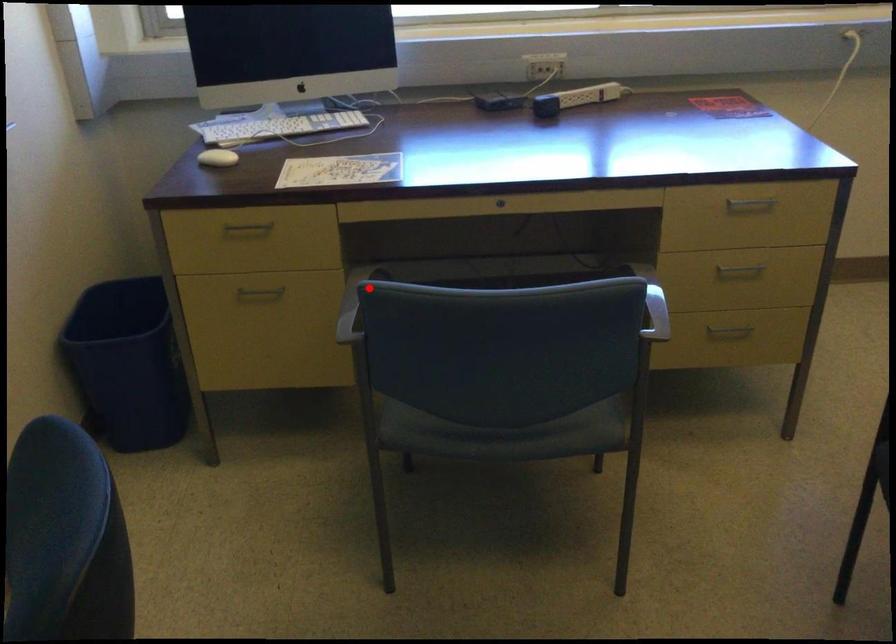
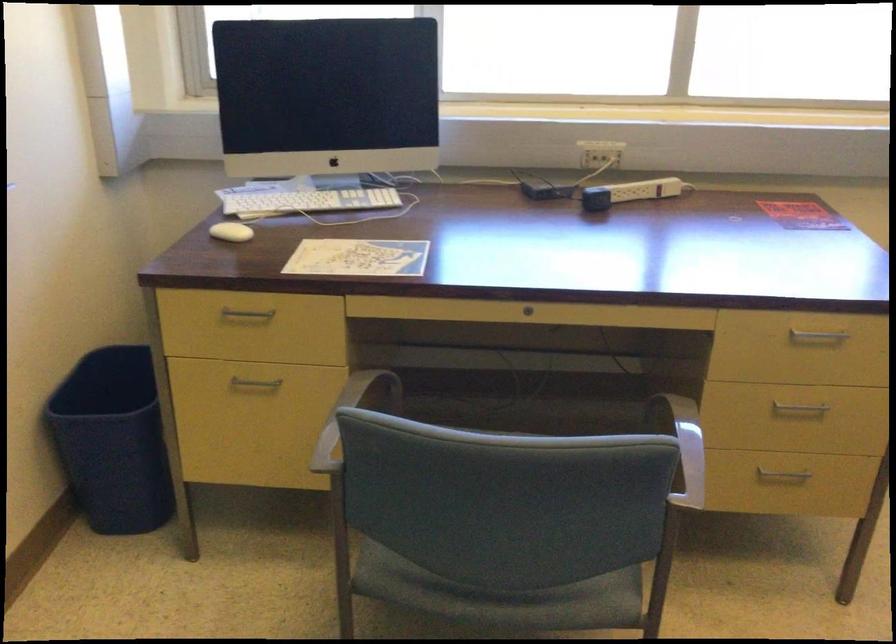
Find the pixel in the second image that matches the highlighted location in the first image.

(350, 415)